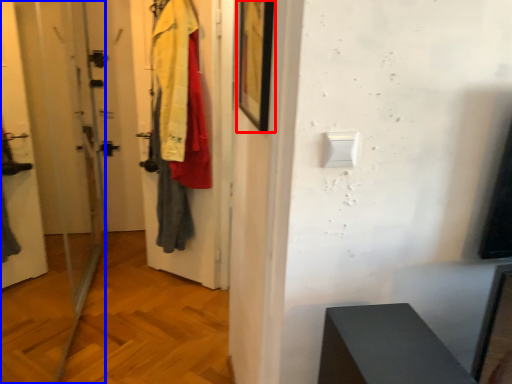
Question: Among these objects, which one is farthest to the camera, picture frame (highlighted by a red box) or screen door (highlighted by a blue box)?

Choices:
 (A) picture frame
 (B) screen door

Answer: (A)